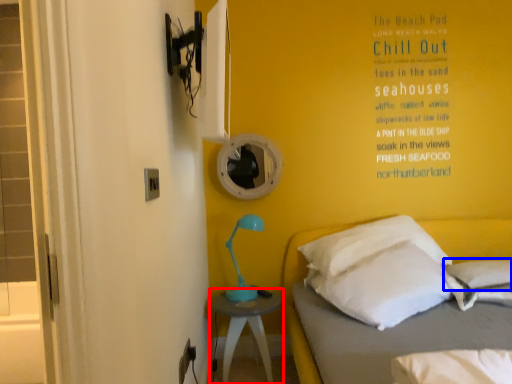
Question: Which of the following is the closest to the observer, nightstand (highlighted by a red box) or pillow (highlighted by a blue box)?

Choices:
 (A) nightstand
 (B) pillow

Answer: (B)